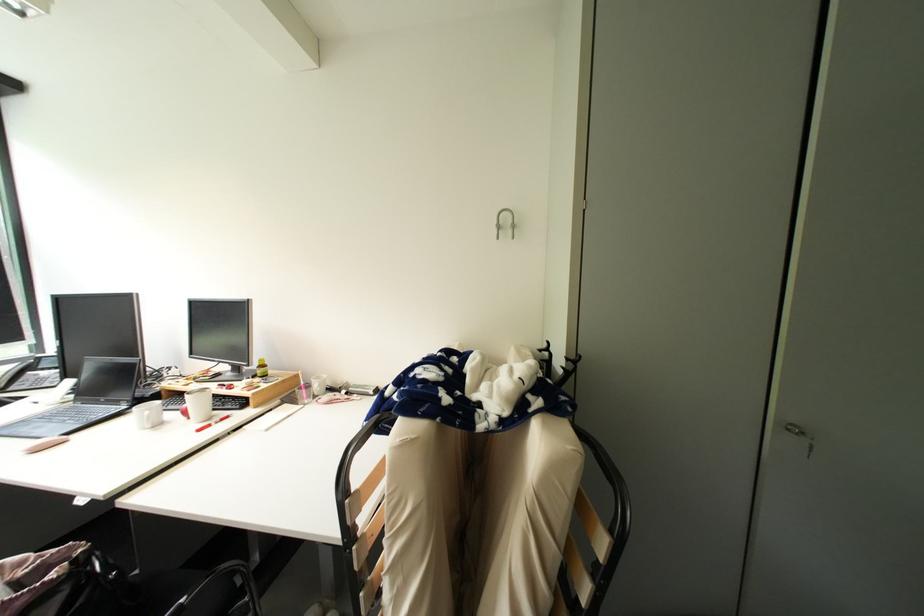
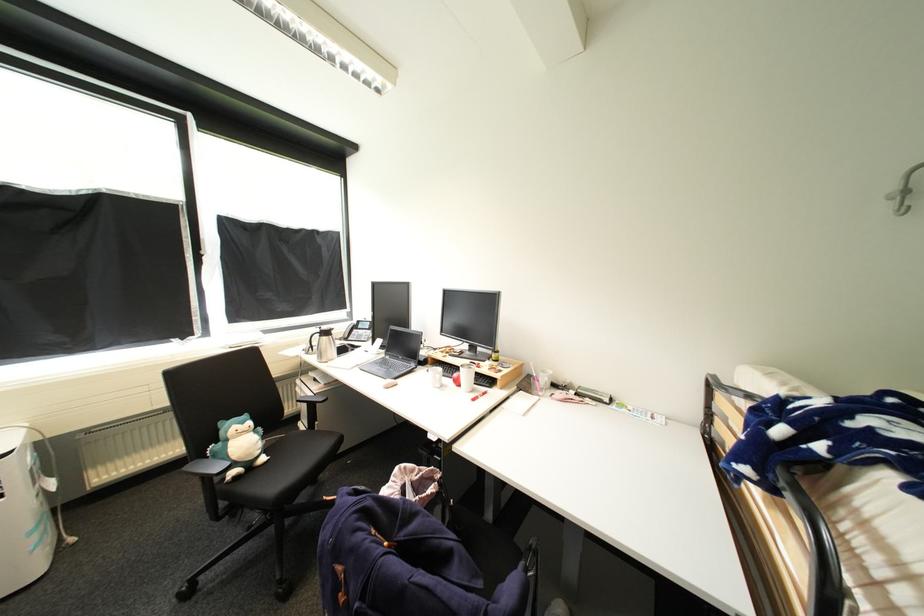
In the second image, find the point that corresponds to (191,406) in the first image.

(462, 376)